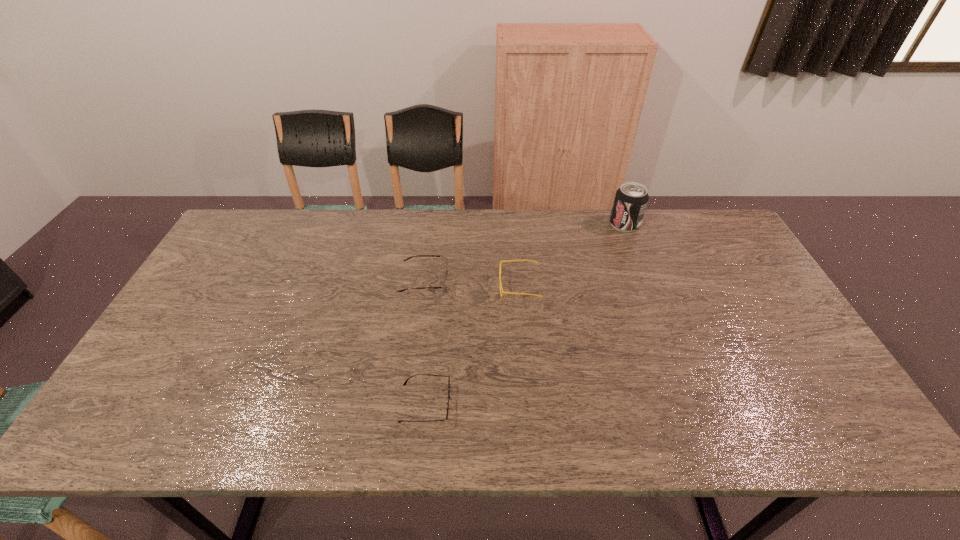
You are a GUI agent. You are given a task and a screenshot of the screen. Output one action in this format:
    pyautogui.click(x=<x>, y=<y>)
    Task: Click on the object located in the far edge section of the desktop
    
    Given the screenshot: What is the action you would take?
    pos(631,199)

Where is `object situated at the near edge`? This screenshot has width=960, height=540. object situated at the near edge is located at coordinates (447, 402).

Identify the location of free space at the far edge of the desktop. Image resolution: width=960 pixels, height=540 pixels. (452, 225).

Where is `vacant space at the near edge of the desktop`? The width and height of the screenshot is (960, 540). vacant space at the near edge of the desktop is located at coordinates (332, 409).

Identify the location of free region at the left edge of the desktop. (156, 353).

Identify the location of vacant area at the right edge of the desktop. (764, 352).

In the image, there is a desktop. At what (x,y) coordinates should I click in order to perform the action: click on free space at the far left corner. Please return your answer as a coordinate pair (x, y). Image resolution: width=960 pixels, height=540 pixels. Looking at the image, I should click on (245, 212).

The image size is (960, 540). What are the coordinates of `vacant area at the near left corner of the desktop` in the screenshot? It's located at (143, 408).

Locate an element on the screen. free point between the rightmost object and the second object from right to left is located at coordinates (572, 255).

Where is `free spot between the shortest object and the rightmost spectacles`? Image resolution: width=960 pixels, height=540 pixels. free spot between the shortest object and the rightmost spectacles is located at coordinates (472, 345).